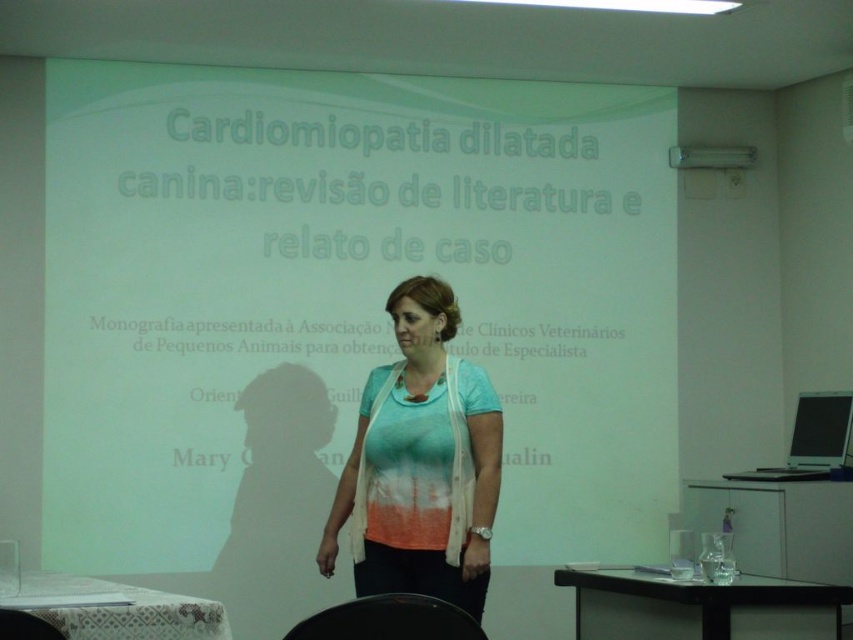
Question: From the image, what is the correct spatial relationship of white matte projection screen at center in relation to light blue cotton shirt at center?

Choices:
 (A) right
 (B) left

Answer: (B)

Question: Can you confirm if white matte projection screen at center is positioned below light blue cotton shirt at center?

Choices:
 (A) yes
 (B) no

Answer: (B)

Question: Is white matte projection screen at center bigger than light blue cotton shirt at center?

Choices:
 (A) yes
 (B) no

Answer: (A)

Question: Which point is closer to the camera?

Choices:
 (A) (489, 502)
 (B) (463, 340)

Answer: (A)